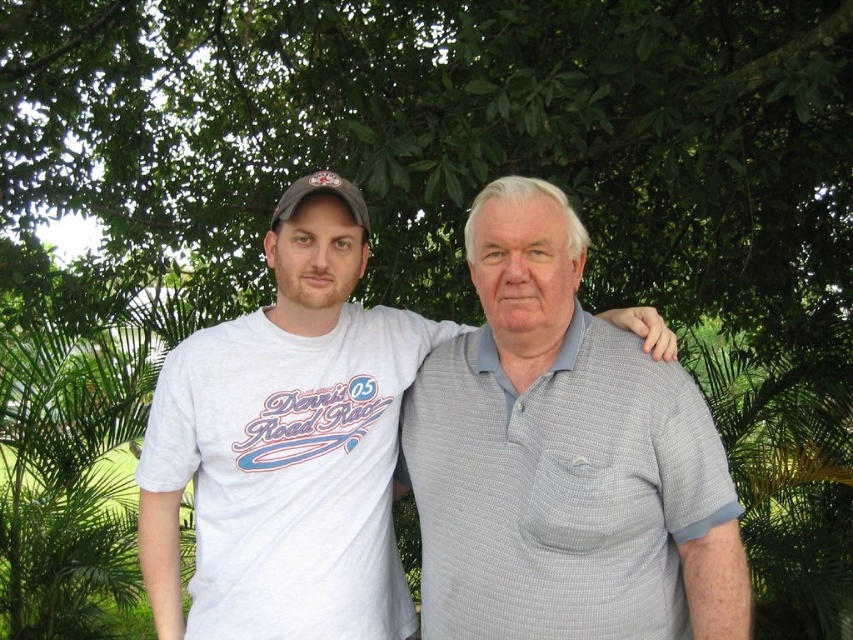
You are a photographer who needs to adjust the lighting to highlight both the gray textured polo shirt at center and the matte gray baseball cap at left. Since the cap is positioned above the shirt, where should you direct the light source to avoid shadows on the cap?

The gray textured polo shirt at center is located below the matte gray baseball cap at left, so directing the light source from above the cap would cast its shadow downward onto the shirt, avoiding shadow on the cap itself.